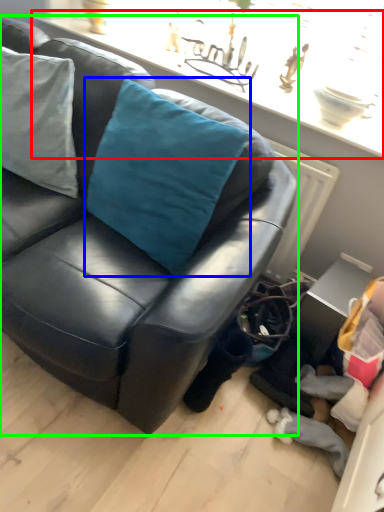
Question: Estimate the real-world distances between objects in this image. Which object is closer to window sill (highlighted by a red box), throw pillow (highlighted by a blue box) or studio couch (highlighted by a green box)?

Choices:
 (A) throw pillow
 (B) studio couch

Answer: (A)